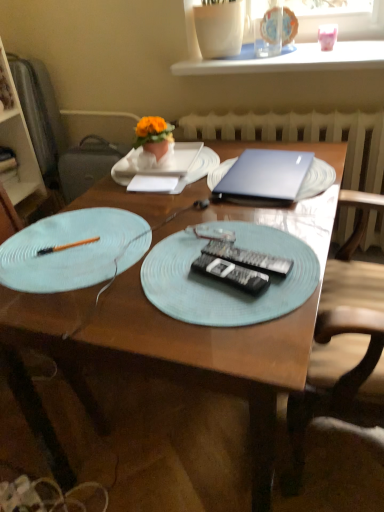
This screenshot has width=384, height=512. What are the coordinates of `free space to the back side of black plastic remote control at center, placed as the 2th remote control when sorted from bottom to top` in the screenshot? It's located at (238, 227).